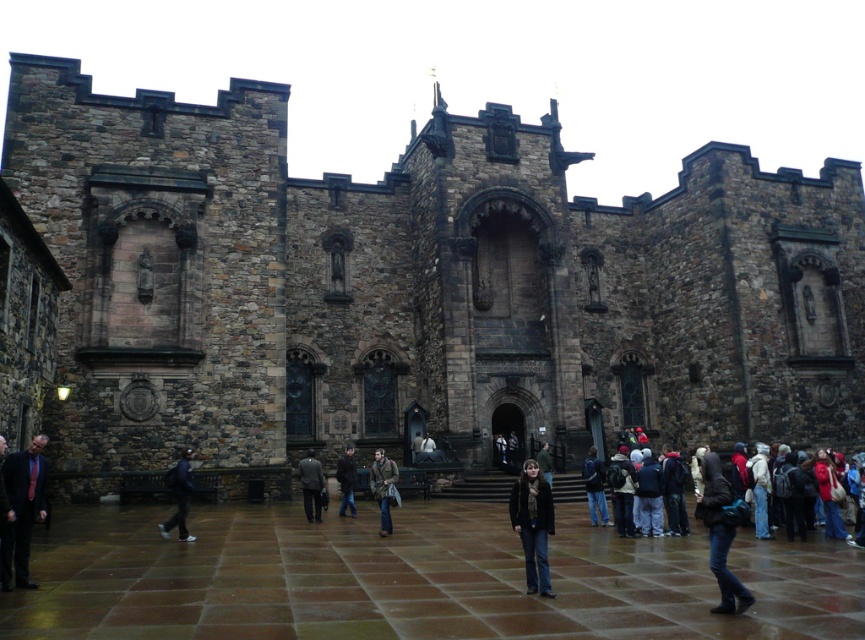
Is denim jacket at center smaller than dark brown leather jacket at center?

Incorrect, denim jacket at center is not smaller in size than dark brown leather jacket at center.

Does denim jacket at center appear on the left side of dark brown leather jacket at center?

Correct, you'll find denim jacket at center to the left of dark brown leather jacket at center.

The height and width of the screenshot is (640, 865). What do you see at coordinates (533, 524) in the screenshot? I see `denim jacket at center` at bounding box center [533, 524].

The height and width of the screenshot is (640, 865). I want to click on denim jacket at center, so click(533, 524).

The image size is (865, 640). What are the coordinates of `denim jeans at lower right` in the screenshot? It's located at (721, 536).

From the picture: Which is more to the right, denim jeans at lower right or dark gray wool coat at center?

denim jeans at lower right is more to the right.

Is point (721, 556) in front of point (347, 506)?

Yes, it is.

You are a GUI agent. You are given a task and a screenshot of the screen. Output one action in this format:
    pyautogui.click(x=<x>, y=<y>)
    Task: Click on the denim jeans at lower right
    
    Given the screenshot: What is the action you would take?
    pyautogui.click(x=721, y=536)

Does brown stone castle at center appear under dark gray sweater at center?

Incorrect, brown stone castle at center is not positioned below dark gray sweater at center.

Based on the photo, is brown stone castle at center wider than dark gray sweater at center?

Indeed, brown stone castle at center has a greater width compared to dark gray sweater at center.

The width and height of the screenshot is (865, 640). What are the coordinates of `brown stone castle at center` in the screenshot? It's located at (420, 285).

Where is `brown stone castle at center`? brown stone castle at center is located at coordinates point(420,285).